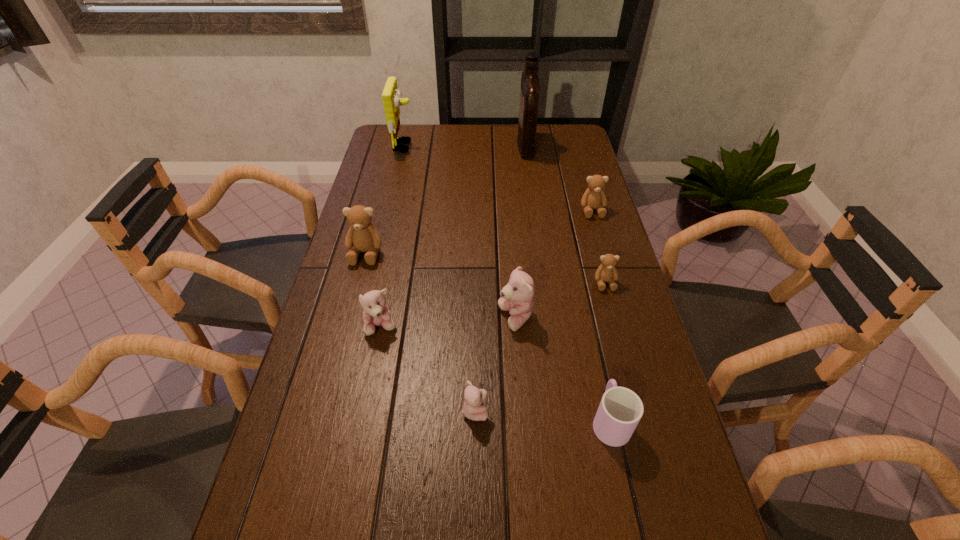
This screenshot has width=960, height=540. Identify the location of free space between the farthest teddy bear and the leftmost brown teddy bear. (479, 232).

The width and height of the screenshot is (960, 540). Identify the location of unoccupied position between the second pink teddy bear from right to left and the third teddy bear from right to left. (495, 364).

Image resolution: width=960 pixels, height=540 pixels. Identify the location of unoccupied area between the tallest object and the third teddy bear from right to left. (520, 232).

You are a GUI agent. You are given a task and a screenshot of the screen. Output one action in this format:
    pyautogui.click(x=<x>, y=<y>)
    Task: Click on the vacant area that lies between the third farthest object and the second biggest pink teddy bear
    Image resolution: width=960 pixels, height=540 pixels.
    Given the screenshot: What is the action you would take?
    click(487, 268)

You are a GUI agent. You are given a task and a screenshot of the screen. Output one action in this format:
    pyautogui.click(x=<x>, y=<y>)
    Task: Click on the empty space that is in between the second pink teddy bear from right to left and the leftmost pink teddy bear
    
    Given the screenshot: What is the action you would take?
    pyautogui.click(x=428, y=368)

Identify the location of object that is the fifth closest to the rightmost pink teddy bear. The width and height of the screenshot is (960, 540). (362, 235).

Where is `the second closest object to the farthest brown teddy bear`? The height and width of the screenshot is (540, 960). the second closest object to the farthest brown teddy bear is located at coordinates (530, 86).

Image resolution: width=960 pixels, height=540 pixels. In order to click on teddy bear that is the second nearest to the sixth object from left to right in this screenshot , I will do `click(606, 272)`.

The width and height of the screenshot is (960, 540). I want to click on teddy bear that is the fourth closest to the cup, so click(376, 313).

Where is `pink teddy bear that is the second closest one to the fourth object from left to right`? pink teddy bear that is the second closest one to the fourth object from left to right is located at coordinates (376, 313).